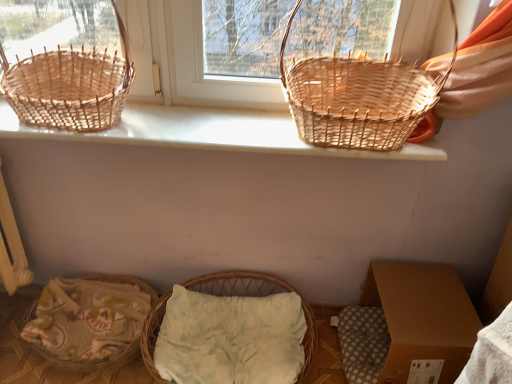
Question: Is brown cardboard box at lower right facing away from woven natural basket at left, which is the 1th picnic basket in left-to-right order?

Choices:
 (A) no
 (B) yes

Answer: (A)

Question: Can you confirm if brown cardboard box at lower right is bigger than woven natural basket at left, the third picnic basket ordered from the bottom?

Choices:
 (A) yes
 (B) no

Answer: (B)

Question: Considering the relative sizes of brown cardboard box at lower right and woven natural basket at left, marked as the 3th picnic basket in a right-to-left arrangement, in the image provided, is brown cardboard box at lower right wider than woven natural basket at left, marked as the 3th picnic basket in a right-to-left arrangement,?

Choices:
 (A) yes
 (B) no

Answer: (A)

Question: From the image's perspective, is brown cardboard box at lower right located beneath woven natural basket at left, which appears as the 1th picnic basket when viewed from the top?

Choices:
 (A) no
 (B) yes

Answer: (B)

Question: Is brown cardboard box at lower right facing towards woven natural basket at left, which appears as the 1th picnic basket when viewed from the top?

Choices:
 (A) no
 (B) yes

Answer: (A)

Question: Would you consider brown cardboard box at lower right to be distant from woven natural basket at left, which appears as the 1th picnic basket when viewed from the top?

Choices:
 (A) yes
 (B) no

Answer: (A)

Question: From the image's perspective, would you say woven natural basket at left, which appears as the 1th picnic basket when viewed from the top, is shown under brown cardboard box at lower right?

Choices:
 (A) yes
 (B) no

Answer: (B)

Question: Can you see woven natural basket at left, which appears as the 1th picnic basket when viewed from the top, touching brown cardboard box at lower right?

Choices:
 (A) yes
 (B) no

Answer: (B)

Question: Does woven natural basket at left, which is the 1th picnic basket in left-to-right order, have a lesser width compared to brown cardboard box at lower right?

Choices:
 (A) no
 (B) yes

Answer: (B)

Question: Is woven natural basket at left, which appears as the 1th picnic basket when viewed from the top, facing away from brown cardboard box at lower right?

Choices:
 (A) yes
 (B) no

Answer: (B)

Question: Are woven natural basket at left, marked as the 3th picnic basket in a right-to-left arrangement, and brown cardboard box at lower right located far from each other?

Choices:
 (A) yes
 (B) no

Answer: (A)

Question: Is woven natural basket at left, which appears as the 1th picnic basket when viewed from the top, taller than brown cardboard box at lower right?

Choices:
 (A) yes
 (B) no

Answer: (A)

Question: Is natural wicker basket at lower left located within brown cardboard box at lower right?

Choices:
 (A) yes
 (B) no

Answer: (B)